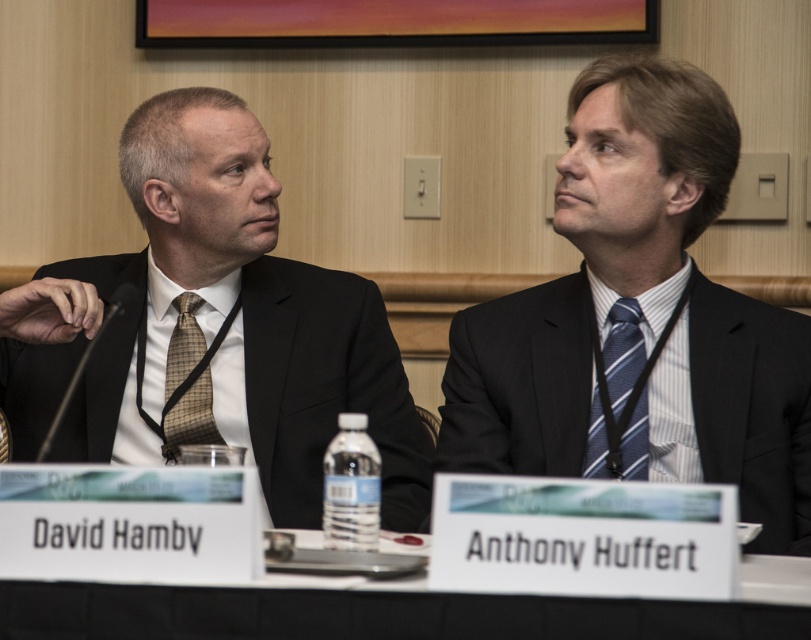
Question: Is matte black suit at left wider than blue striped tie at center?

Choices:
 (A) yes
 (B) no

Answer: (A)

Question: Which object is positioned farthest from the brown checkered tie at left?

Choices:
 (A) white plastic table at center
 (B) blue striped tie at center

Answer: (A)

Question: Can you confirm if matte black suit at left is thinner than white plastic table at center?

Choices:
 (A) no
 (B) yes

Answer: (B)

Question: Which point is closer to the camera?

Choices:
 (A) matte black suit at center
 (B) white plastic table at center
 (C) brown checkered tie at left
 (D) blue striped tie at center

Answer: (B)

Question: Does matte black suit at center appear on the right side of brown checkered tie at left?

Choices:
 (A) no
 (B) yes

Answer: (B)

Question: Which point is closer to the camera taking this photo?

Choices:
 (A) pyautogui.click(x=228, y=275)
 (B) pyautogui.click(x=191, y=384)
 (C) pyautogui.click(x=147, y=634)
 (D) pyautogui.click(x=681, y=348)

Answer: (C)